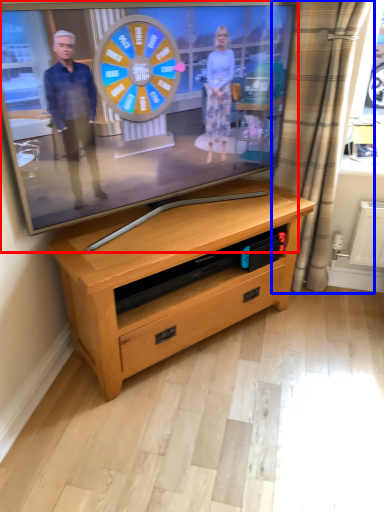
Question: Which object appears farthest to the camera in this image, television (highlighted by a red box) or curtain (highlighted by a blue box)?

Choices:
 (A) television
 (B) curtain

Answer: (B)